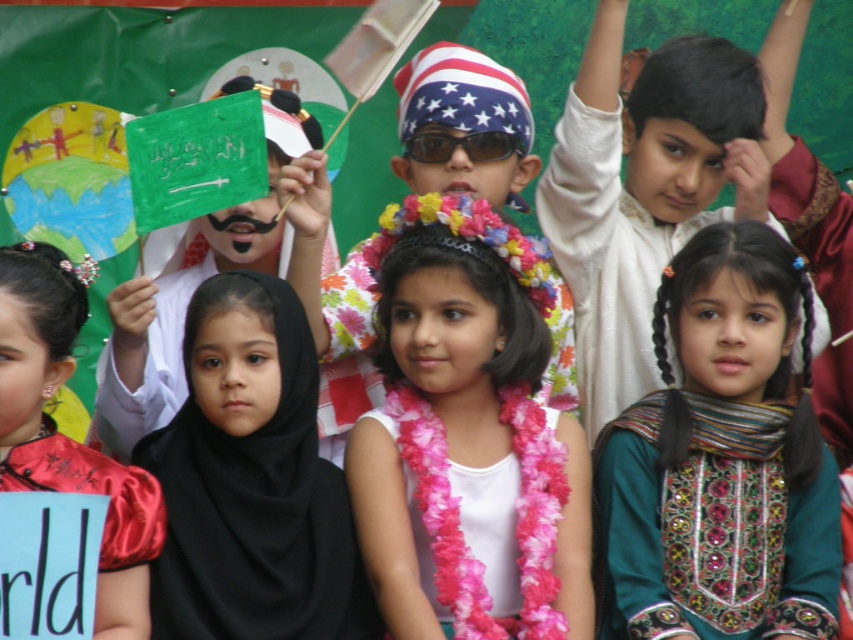
You are a photographer standing at the back of the room. You want to take a clear photo of the black fabric hijab at center. Considering the distance, is it possible to capture it clearly without moving closer?

The black fabric hijab at center is 27.87 meters away from the camera. This distance may be too far for a standard camera to capture clear details of the hijab without using a zoom lens or moving closer. Therefore, it is recommended to use a zoom lens or move closer to ensure clarity.

You are a photographer at the event and need to capture both the black fabric hijab at center and the red satin dress at left in a single frame. Based on their positions, which object should you focus on first to ensure both are in the frame?

The black fabric hijab at center is above the red satin dress at left, so you should focus on the black fabric hijab at center first to ensure both are in the frame.

You are a photographer taking a picture of the cultural event. You notice the pink fabric lei at center and the reflective plastic sunglasses at center. Which object should you avoid placing in the center of your photo if you want to highlight the wider one?

The reflective plastic sunglasses at center is wider than the pink fabric lei at center, so to highlight the wider object, you should avoid placing the pink fabric lei at center in the center of the photo.